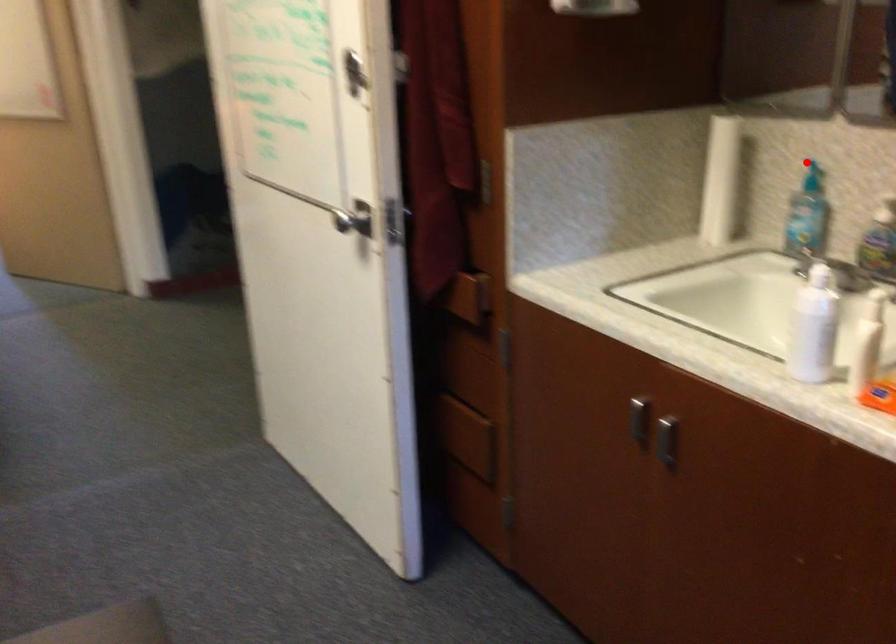
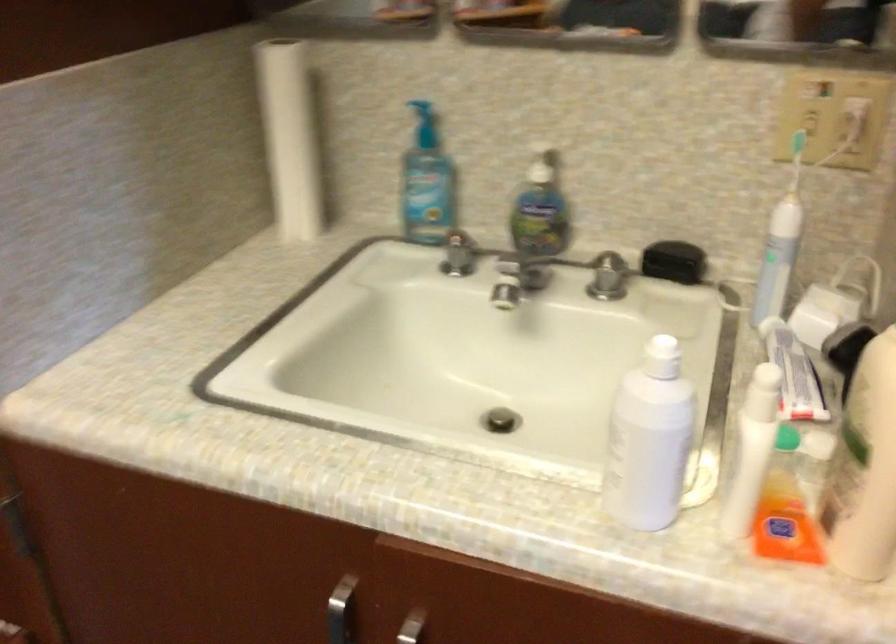
In the second image, find the point that corresponds to the highlighted location in the first image.

(423, 109)